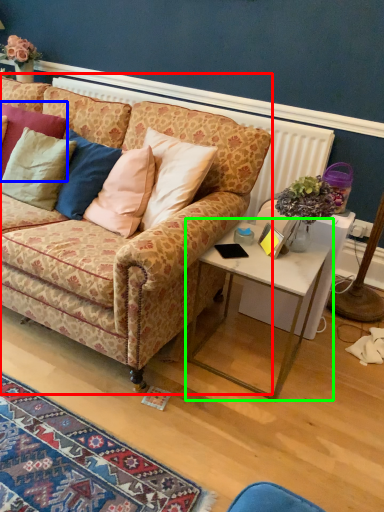
Question: Estimate the real-world distances between objects in this image. Which object is farther from studio couch (highlighted by a red box), pillow (highlighted by a blue box) or table (highlighted by a green box)?

Choices:
 (A) pillow
 (B) table

Answer: (A)